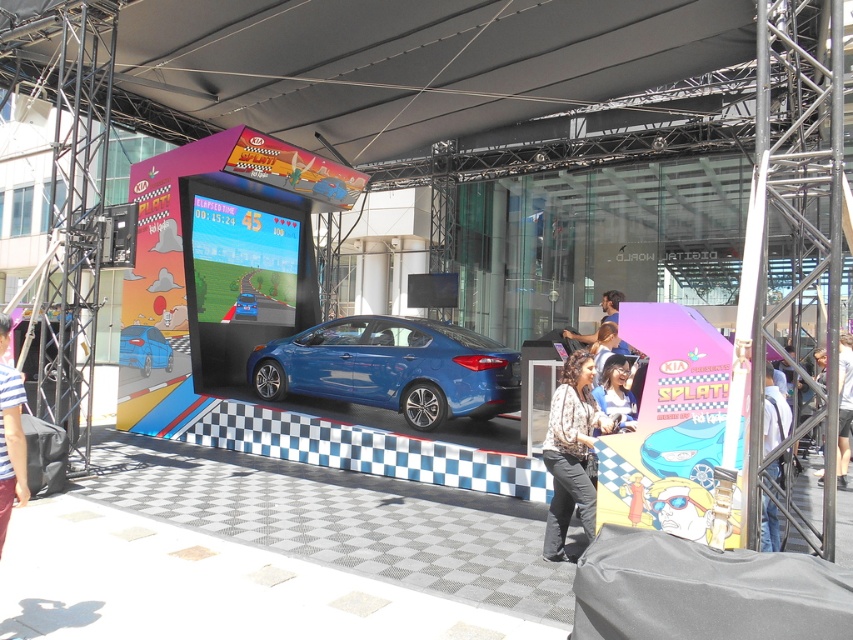
Question: Does striped fabric shirt at lower left come in front of white fabric at center?

Choices:
 (A) yes
 (B) no

Answer: (A)

Question: Which point is farther from the camera taking this photo?

Choices:
 (A) (134, 349)
 (B) (778, 410)
 (C) (846, 390)
 (D) (347, 342)

Answer: (A)

Question: Which of the following is the farthest from the observer?

Choices:
 (A) (576, 332)
 (B) (558, 433)
 (C) (599, 339)

Answer: (A)

Question: Which point is farther to the camera?

Choices:
 (A) (619, 385)
 (B) (775, 426)

Answer: (A)

Question: Does matte black canopy at upper center appear under white fabric at center?

Choices:
 (A) no
 (B) yes

Answer: (A)

Question: Does matte black canopy at upper center appear on the right side of white fabric at center?

Choices:
 (A) yes
 (B) no

Answer: (B)